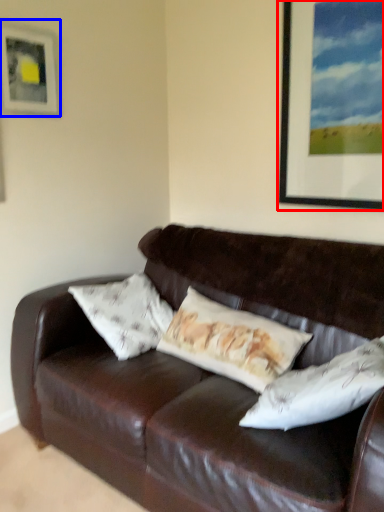
Question: Which object is closer to the camera taking this photo, picture frame (highlighted by a red box) or picture frame (highlighted by a blue box)?

Choices:
 (A) picture frame
 (B) picture frame

Answer: (A)